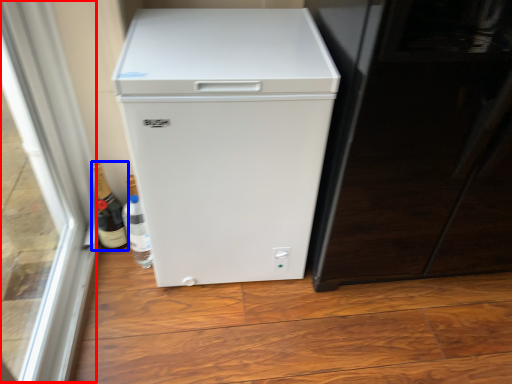
Question: Which of the following is the closest to the observer, glass door (highlighted by a red box) or bottle (highlighted by a blue box)?

Choices:
 (A) glass door
 (B) bottle

Answer: (A)